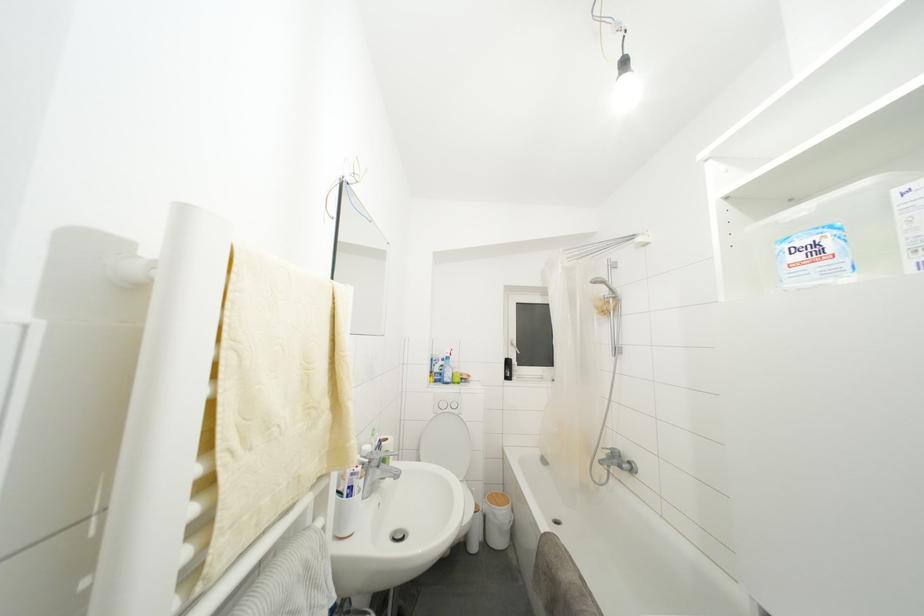
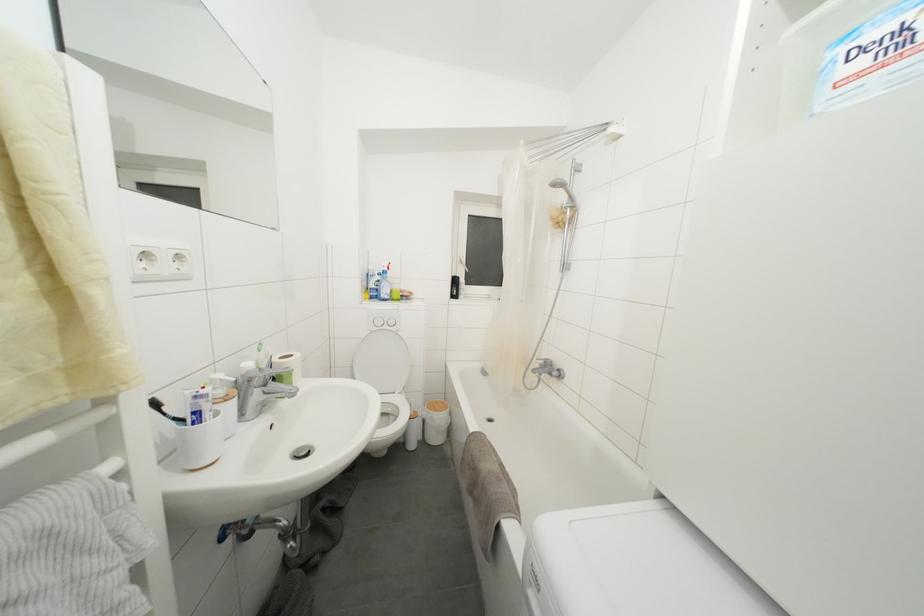
Where in the second image is the point corresponding to point (357, 479) from the first image?

(200, 402)